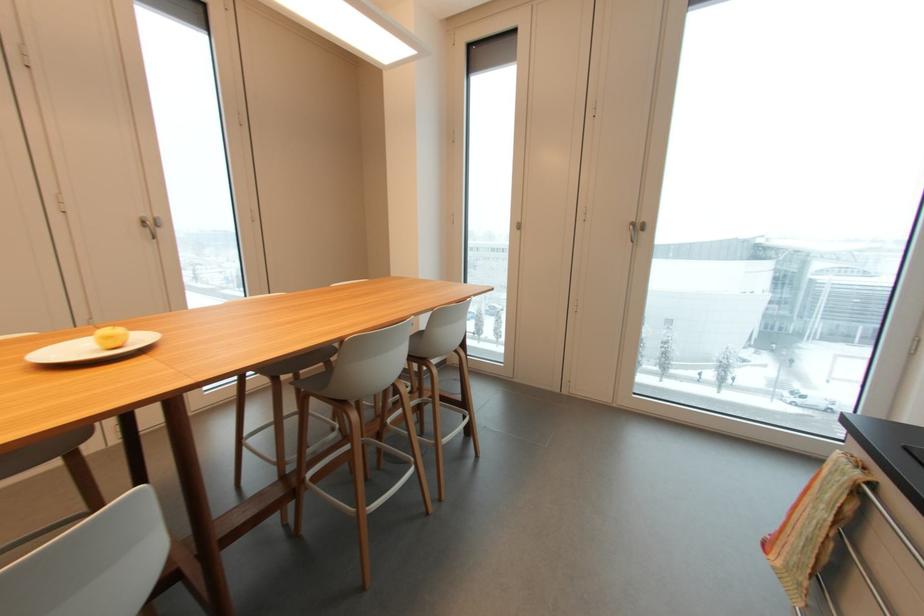
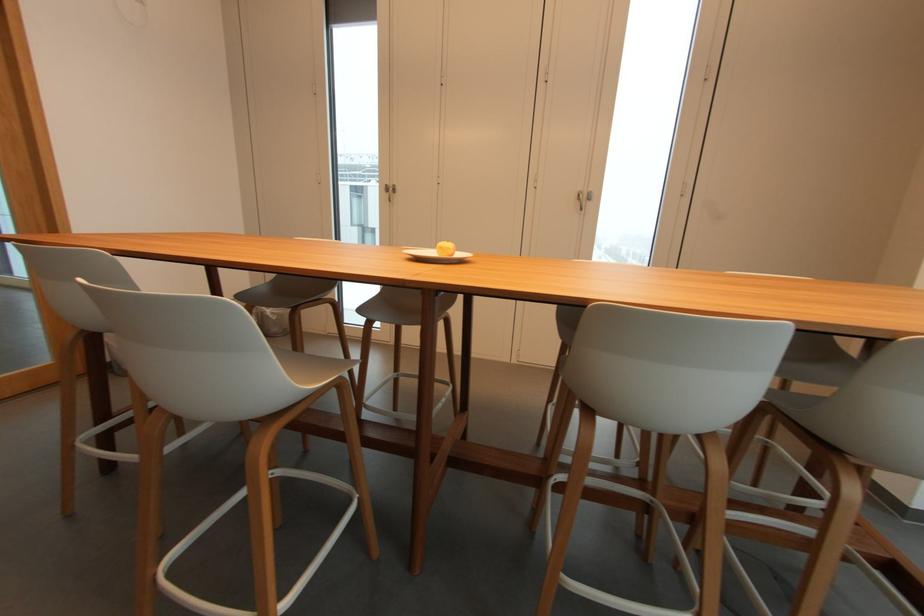
Question: The images are taken continuously from a first-person perspective. In which direction is your viewpoint rotating?

Choices:
 (A) Left
 (B) Right
 (C) Up
 (D) Down

Answer: (A)